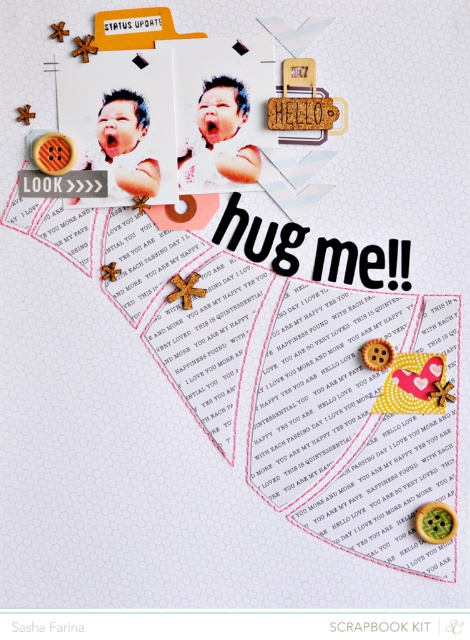
Can you confirm if matte white baby at center is bigger than matte white baby at upper left?

No.

Based on the photo, between matte white baby at center and matte white baby at upper left, which one appears on the right side from the viewer's perspective?

matte white baby at center

Where is `matte white baby at center`? matte white baby at center is located at coordinates (221, 136).

The image size is (470, 640). Identify the location of matte white baby at center. (221, 136).